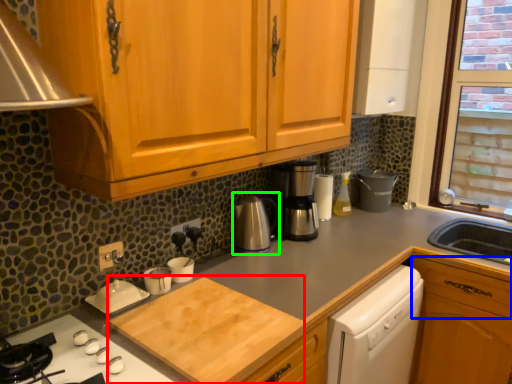
Question: Which object is positioned farthest from cutting board (highlighted by a red box)? Select from drawer (highlighted by a blue box) and coffeepot (highlighted by a green box).

Choices:
 (A) drawer
 (B) coffeepot

Answer: (A)